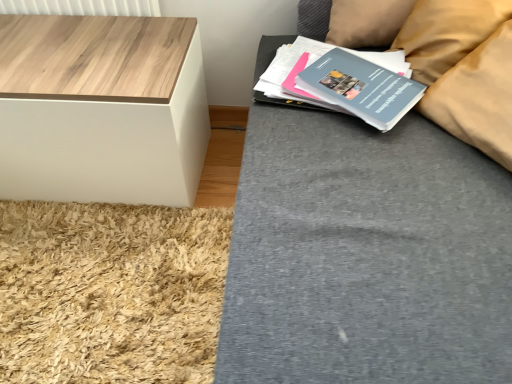
Question: From the image's perspective, is matte blue paperback book at upper right, the 2th paperback book in the front-to-back sequence, below beige fabric pillow at upper right?

Choices:
 (A) yes
 (B) no

Answer: (A)

Question: Considering the relative sizes of matte blue paperback book at upper right, the 2th paperback book in the front-to-back sequence, and beige fabric pillow at upper right in the image provided, is matte blue paperback book at upper right, the 2th paperback book in the front-to-back sequence, smaller than beige fabric pillow at upper right?

Choices:
 (A) yes
 (B) no

Answer: (A)

Question: Is matte blue paperback book at upper right, the 2th paperback book in the front-to-back sequence, wider than beige fabric pillow at upper right?

Choices:
 (A) no
 (B) yes

Answer: (B)

Question: Does matte blue paperback book at upper right, the 1th paperback book viewed from the back, appear on the left side of beige fabric pillow at upper right?

Choices:
 (A) no
 (B) yes

Answer: (B)

Question: From the image's perspective, does matte blue paperback book at upper right, the 2th paperback book in the front-to-back sequence, appear higher than beige fabric pillow at upper right?

Choices:
 (A) no
 (B) yes

Answer: (A)

Question: Does matte blue paperback book at upper right, the 2th paperback book in the front-to-back sequence, touch beige fabric pillow at upper right?

Choices:
 (A) yes
 (B) no

Answer: (B)

Question: Is beige fabric pillow at upper right wider than matte gray paperback book at upper right, the second paperback book positioned from the back?

Choices:
 (A) yes
 (B) no

Answer: (A)

Question: From the image's perspective, is beige fabric pillow at upper right on matte gray paperback book at upper right, the first paperback book when ordered from front to back?

Choices:
 (A) no
 (B) yes

Answer: (B)

Question: From the image's perspective, is beige fabric pillow at upper right beneath matte gray paperback book at upper right, the first paperback book when ordered from front to back?

Choices:
 (A) yes
 (B) no

Answer: (B)

Question: Can you confirm if beige fabric pillow at upper right is taller than matte gray paperback book at upper right, the second paperback book positioned from the back?

Choices:
 (A) yes
 (B) no

Answer: (A)

Question: Considering the relative sizes of beige fabric pillow at upper right and matte gray paperback book at upper right, the second paperback book positioned from the back, in the image provided, is beige fabric pillow at upper right thinner than matte gray paperback book at upper right, the second paperback book positioned from the back,?

Choices:
 (A) yes
 (B) no

Answer: (B)

Question: Is matte gray paperback book at upper right, the first paperback book when ordered from front to back, inside beige fabric pillow at upper right?

Choices:
 (A) no
 (B) yes

Answer: (A)

Question: Is beige fabric pillow at upper right wider than matte blue paperback book at upper right, the 1th paperback book viewed from the back?

Choices:
 (A) yes
 (B) no

Answer: (B)